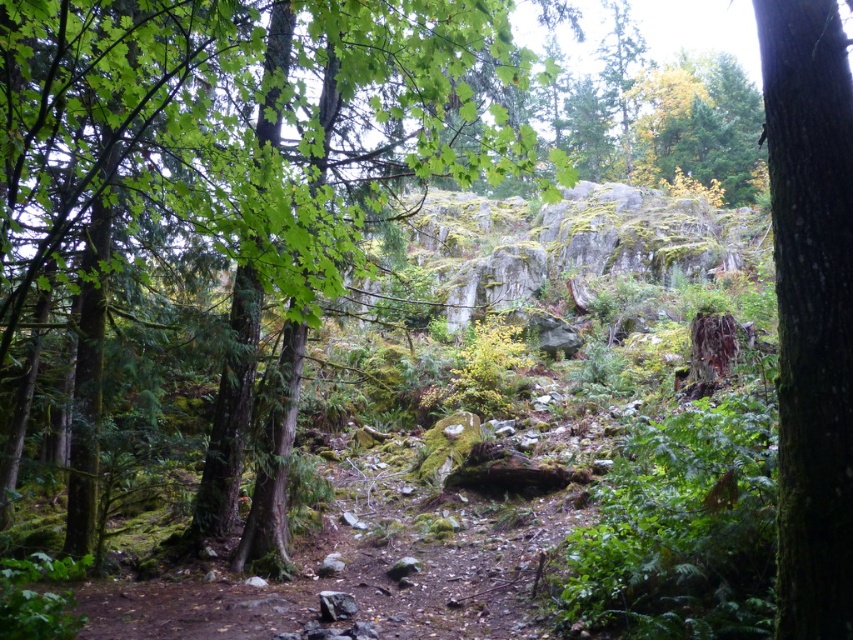
You are a hiker trying to navigate through the forest. You see a green mossy tree at center and a green mossy bark tree at right. Which tree is positioned more to the left side of the forest path?

The green mossy tree at center is positioned more to the left side of the forest path than the green mossy bark tree at right.

You are a hiker navigating a forest path and see the green mossy tree at center and the green mossy bark tree at right. Which tree is positioned higher in the image?

The green mossy tree at center is positioned higher than the green mossy bark tree at right in the image.

You are a hiker with a 9.5 feet long rope. You want to cross a gap between two points in the forest. The points are labeled as point (45, 177). Can your rope reach across the gap between them?

The distance between the points is 10.04 feet, which is slightly longer than your 9.5 feet rope. Therefore, the rope cannot reach across the gap between point (45, 177).